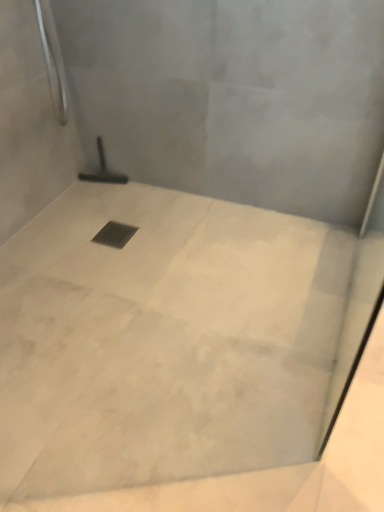
Where is `free space on the front side of black rubber squeegee at center`? The image size is (384, 512). free space on the front side of black rubber squeegee at center is located at coordinates (108, 205).